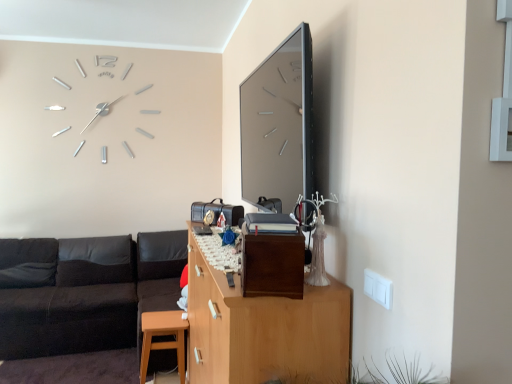
Question: Considering the relative sizes of matte wood stool at lower left and black leather couch at left in the image provided, is matte wood stool at lower left taller than black leather couch at left?

Choices:
 (A) no
 (B) yes

Answer: (A)

Question: Are matte wood stool at lower left and black leather couch at left making contact?

Choices:
 (A) yes
 (B) no

Answer: (B)

Question: Can you confirm if matte wood stool at lower left is positioned to the left of black leather couch at left?

Choices:
 (A) no
 (B) yes

Answer: (A)

Question: Considering the relative sizes of matte wood stool at lower left and black leather couch at left in the image provided, is matte wood stool at lower left shorter than black leather couch at left?

Choices:
 (A) yes
 (B) no

Answer: (A)

Question: Is matte wood stool at lower left turned away from black leather couch at left?

Choices:
 (A) yes
 (B) no

Answer: (B)

Question: Can you confirm if matte wood stool at lower left is positioned to the right of black leather couch at left?

Choices:
 (A) yes
 (B) no

Answer: (A)

Question: Is wooden cabinet at center to the right of black leather couch at left from the viewer's perspective?

Choices:
 (A) yes
 (B) no

Answer: (A)

Question: Does wooden cabinet at center have a lesser height compared to black leather couch at left?

Choices:
 (A) no
 (B) yes

Answer: (A)

Question: Is wooden cabinet at center positioned behind black leather couch at left?

Choices:
 (A) yes
 (B) no

Answer: (B)

Question: Is wooden cabinet at center touching black leather couch at left?

Choices:
 (A) no
 (B) yes

Answer: (A)

Question: Is the position of wooden cabinet at center less distant than that of black leather couch at left?

Choices:
 (A) yes
 (B) no

Answer: (A)

Question: Is wooden cabinet at center not inside black leather couch at left?

Choices:
 (A) yes
 (B) no

Answer: (A)

Question: Does black leather couch at lower left have a greater height compared to matte wood stool at lower left?

Choices:
 (A) no
 (B) yes

Answer: (B)